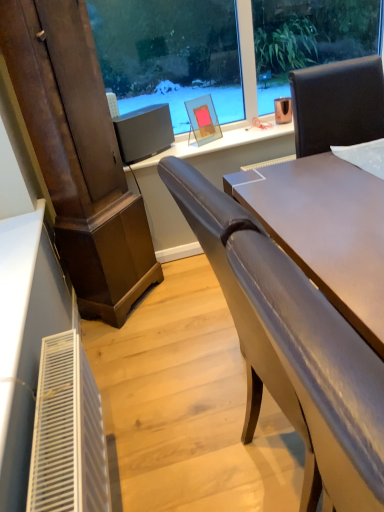
Where is `matte gray chair at center`? This screenshot has height=512, width=384. matte gray chair at center is located at coordinates (284, 330).

What do you see at coordinates (144, 132) in the screenshot? The height and width of the screenshot is (512, 384). I see `matte black monitor at center` at bounding box center [144, 132].

I want to click on matte gray chair at center, so click(x=284, y=330).

From the image's perspective, which object appears higher, matte gray chair at center or matte glass picture frame at center?

matte glass picture frame at center.

Is matte gray chair at center thinner than matte glass picture frame at center?

No.

Measure the distance between matte gray chair at center and matte glass picture frame at center.

matte gray chair at center is 5.12 feet away from matte glass picture frame at center.

From a real-world perspective, is matte gray chair at center positioned above or below matte glass picture frame at center?

Clearly, from a real-world perspective, matte gray chair at center is below matte glass picture frame at center.

Relative to matte gray chair at center, is matte glass picture frame at center in front or behind?

Clearly, matte glass picture frame at center is behind matte gray chair at center.

From a real-world perspective, is matte glass picture frame at center beneath matte gray chair at center?

No.

Is matte glass picture frame at center not close to matte gray chair at center?

matte glass picture frame at center is far away from matte gray chair at center.

How distant is matte glass picture frame at center from matte gray chair at center?

matte glass picture frame at center and matte gray chair at center are 1.56 meters apart.

In terms of width, does matte black monitor at center look wider or thinner when compared to matte glass picture frame at center?

Considering their sizes, matte black monitor at center looks broader than matte glass picture frame at center.

In the image, is matte black monitor at center positioned in front of or behind matte glass picture frame at center?

matte black monitor at center is in front of matte glass picture frame at center.

Between matte black monitor at center and matte glass picture frame at center, which one has more height?

matte glass picture frame at center.

Based on their positions, is matte black monitor at center located to the left or right of matte glass picture frame at center?

matte black monitor at center is positioned on matte glass picture frame at center's left side.

Is matte gray chair at center not close to matte black monitor at center?

Absolutely, matte gray chair at center is distant from matte black monitor at center.

Where is `computer monitor on the left of the matte gray chair at center`? computer monitor on the left of the matte gray chair at center is located at coordinates (144, 132).

Consider the image. How different are the orientations of matte gray chair at center and matte black monitor at center in degrees?

They differ by 64.4 degrees in their facing directions.

From the image's perspective, would you say matte gray chair at center is shown under matte black monitor at center?

Yes, from the image's perspective, matte gray chair at center is below matte black monitor at center.

Which point is more forward, (x=146, y=153) or (x=362, y=504)?

The point (x=362, y=504) is more forward.

In terms of width, does matte black monitor at center look wider or thinner when compared to matte gray chair at center?

matte black monitor at center is thinner than matte gray chair at center.

From the image's perspective, which is below, matte black monitor at center or matte gray chair at center?

matte gray chair at center is shown below in the image.

Is matte glass picture frame at center not near matte black monitor at center?

That's not correct — matte glass picture frame at center is a little close to matte black monitor at center.

From the picture: Can you confirm if matte glass picture frame at center is smaller than matte black monitor at center?

Correct, matte glass picture frame at center occupies less space than matte black monitor at center.

Considering the positions of point (217, 127) and point (167, 104), is point (217, 127) closer or farther from the camera than point (167, 104)?

Point (217, 127).

This screenshot has height=512, width=384. Identify the location of picture frame lying on the left of matte gray chair at center. (203, 119).

The height and width of the screenshot is (512, 384). Identify the location of chair in front of the matte glass picture frame at center. (284, 330).

Looking at the image, which one is located closer to matte gray chair at center, matte black monitor at center or matte glass picture frame at center?

Based on the image, matte black monitor at center appears to be nearer to matte gray chair at center.

From the image, which object appears to be nearer to matte black monitor at center, matte glass picture frame at center or matte gray chair at center?

Answer: Based on the image, matte glass picture frame at center appears to be nearer to matte black monitor at center.

When comparing their distances from matte gray chair at center, does matte glass picture frame at center or matte black monitor at center seem further?

Based on the image, matte glass picture frame at center appears to be further to matte gray chair at center.

From the image, which object appears to be nearer to matte black monitor at center, matte gray chair at center or matte glass picture frame at center?

Based on the image, matte glass picture frame at center appears to be nearer to matte black monitor at center.

Considering their positions, is matte black monitor at center positioned further to matte glass picture frame at center than matte gray chair at center?

matte gray chair at center is positioned further to the anchor matte glass picture frame at center.

Looking at the image, which one is located further to matte glass picture frame at center, matte gray chair at center or matte black monitor at center?

Based on the image, matte gray chair at center appears to be further to matte glass picture frame at center.

Image resolution: width=384 pixels, height=512 pixels. In order to click on computer monitor between matte gray chair at center and matte glass picture frame at center along the z-axis in this screenshot , I will do `click(144, 132)`.